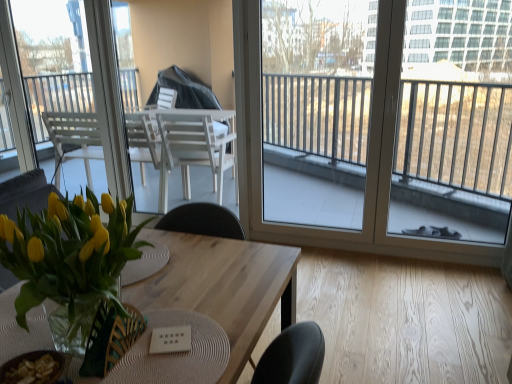
Question: Would you say green woven armchair at center contains transparent glass window at center, which is counted as the 2th window, starting from the back?

Choices:
 (A) yes
 (B) no

Answer: (B)

Question: Does green woven armchair at center appear on the right side of transparent glass window at center, the 2th window when ordered from left to right?

Choices:
 (A) no
 (B) yes

Answer: (A)

Question: Is green woven armchair at center beside transparent glass window at center, which ranks as the first window in front-to-back order?

Choices:
 (A) no
 (B) yes

Answer: (A)

Question: Does green woven armchair at center have a greater height compared to transparent glass window at center, marked as the first window in a right-to-left arrangement?

Choices:
 (A) no
 (B) yes

Answer: (A)

Question: Are green woven armchair at center and transparent glass window at center, which is counted as the 2th window, starting from the back, far apart?

Choices:
 (A) no
 (B) yes

Answer: (B)

Question: Is point (49, 43) positioned closer to the camera than point (133, 336)?

Choices:
 (A) farther
 (B) closer

Answer: (A)

Question: Is transparent glass window at upper left, marked as the 2th window in a right-to-left arrangement, to the left or to the right of green woven armchair at center in the image?

Choices:
 (A) right
 (B) left

Answer: (B)

Question: Looking at their shapes, would you say transparent glass window at upper left, marked as the 2th window in a right-to-left arrangement, is wider or thinner than green woven armchair at center?

Choices:
 (A) thin
 (B) wide

Answer: (A)

Question: Is transparent glass window at upper left, which is the 1th window from left to right, situated inside green woven armchair at center or outside?

Choices:
 (A) outside
 (B) inside

Answer: (A)

Question: Considering their positions, is transparent glass window at center, which is counted as the 2th window, starting from the back, located in front of or behind translucent glass vase at lower left?

Choices:
 (A) front
 (B) behind

Answer: (B)

Question: From the image's perspective, relative to translucent glass vase at lower left, is transparent glass window at center, marked as the first window in a right-to-left arrangement, above or below?

Choices:
 (A) above
 (B) below

Answer: (A)

Question: Is transparent glass window at center, marked as the first window in a right-to-left arrangement, taller or shorter than translucent glass vase at lower left?

Choices:
 (A) short
 (B) tall

Answer: (B)

Question: Would you say transparent glass window at center, the 2th window when ordered from left to right, is inside or outside translucent glass vase at lower left?

Choices:
 (A) inside
 (B) outside

Answer: (B)

Question: From the image's perspective, is green woven armchair at center located above or below translucent glass vase at lower left?

Choices:
 (A) below
 (B) above

Answer: (A)

Question: In the image, is green woven armchair at center positioned in front of or behind translucent glass vase at lower left?

Choices:
 (A) front
 (B) behind

Answer: (B)